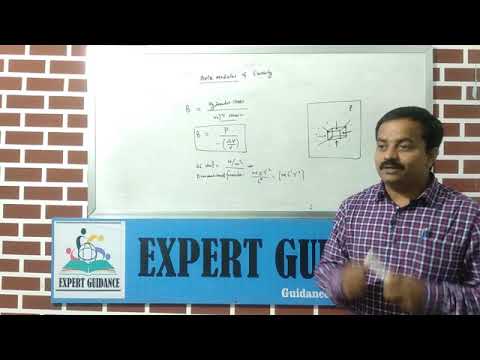
At what (x,y) coordinates should I click in order to perform the action: click on brick wall. Please return your answer as a coordinate pair (x, y). The height and width of the screenshot is (360, 480). Looking at the image, I should click on (65, 189).